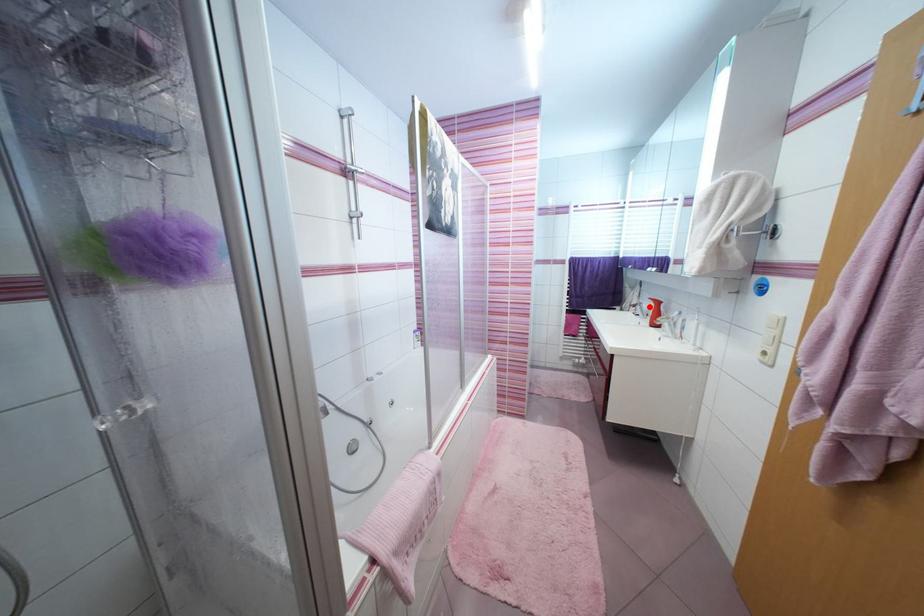
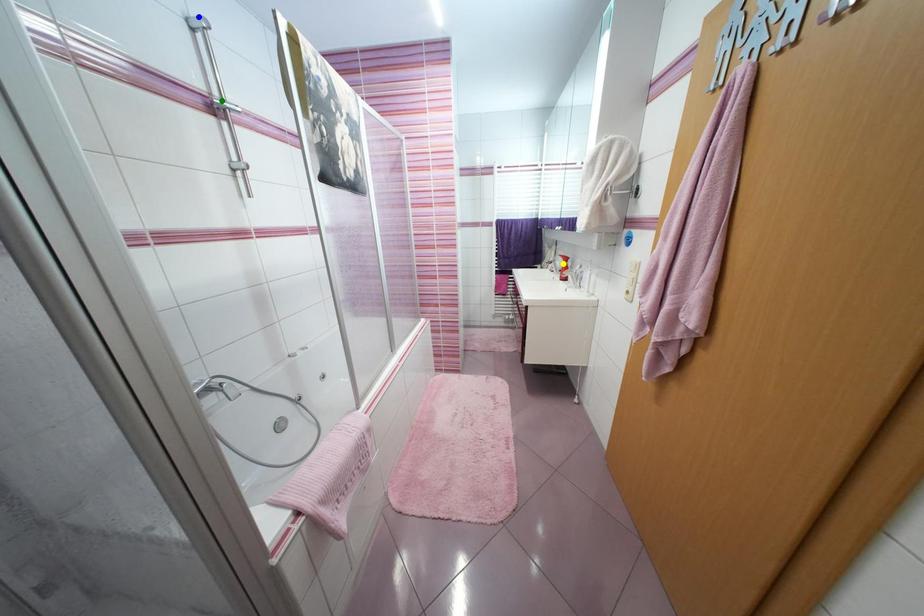
Question: I am providing you with two images of the same scene from different viewpoints. A red point is marked on the first image. You are given multiple points on the second image. Can you choose the point in image 2 that corresponds to the point in image 1?

Choices:
 (A) yellow point
 (B) green point
 (C) blue point

Answer: (A)